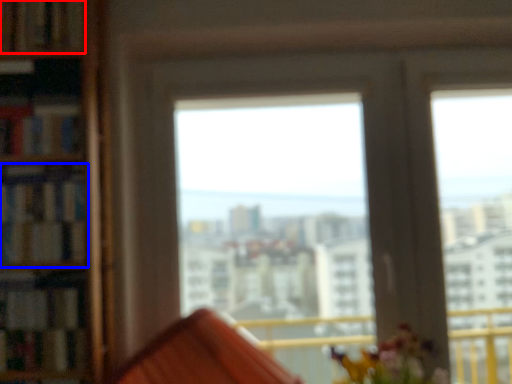
Question: Which object is closer to the camera taking this photo, book (highlighted by a red box) or book (highlighted by a blue box)?

Choices:
 (A) book
 (B) book

Answer: (B)